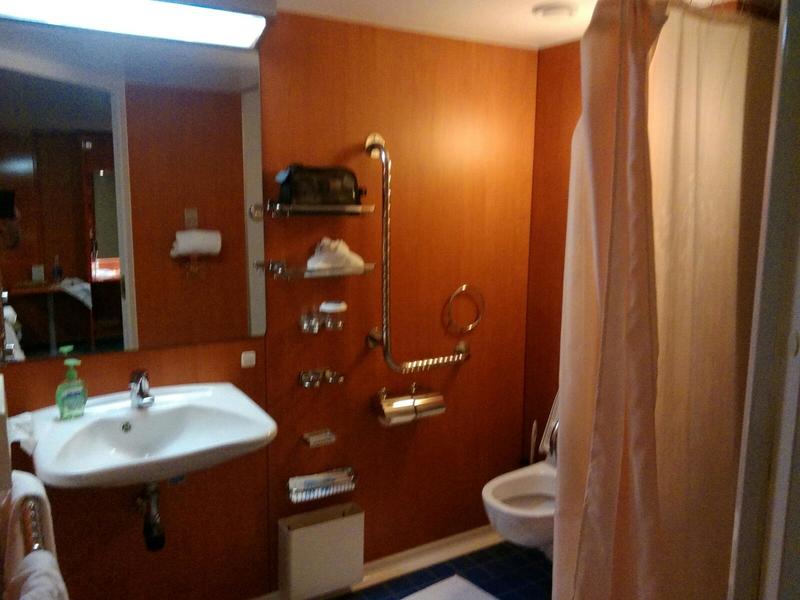
Identify the location of chrome bath towel rail. This screenshot has height=600, width=800. (36, 528).